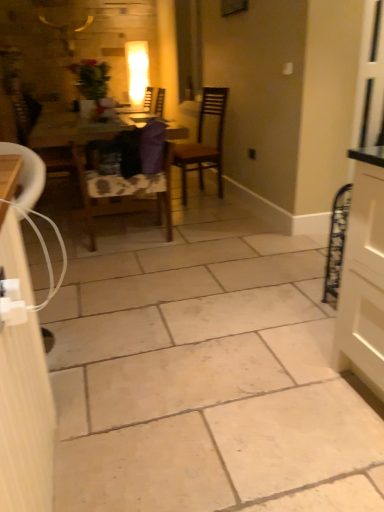
Question: Which direction should I rotate to face brown wooden chair at center, which is counted as the 1th chair, starting from the right, — up or down?

Choices:
 (A) down
 (B) up

Answer: (B)

Question: From the image's perspective, is wooden chair at center, arranged as the second chair when viewed from the right, beneath white glossy cabinet at left?

Choices:
 (A) yes
 (B) no

Answer: (B)

Question: From the image's perspective, is wooden chair at center, which is the 2th chair from left to right, on top of white glossy cabinet at left?

Choices:
 (A) yes
 (B) no

Answer: (A)

Question: Is wooden chair at center, arranged as the second chair when viewed from the right, wider than white glossy cabinet at left?

Choices:
 (A) yes
 (B) no

Answer: (B)

Question: From a real-world perspective, is wooden chair at center, arranged as the second chair when viewed from the right, on top of white glossy cabinet at left?

Choices:
 (A) no
 (B) yes

Answer: (A)

Question: Does wooden chair at center, which is the 2th chair from left to right, have a smaller size compared to white glossy cabinet at left?

Choices:
 (A) yes
 (B) no

Answer: (B)

Question: Does wooden chair at center, which is the 2th chair from left to right, come in front of white glossy cabinet at left?

Choices:
 (A) no
 (B) yes

Answer: (A)

Question: Is wooden chair at center, which is the 2th chair from left to right, facing towards wooden chair at left, marked as the 1th chair in a left-to-right arrangement?

Choices:
 (A) no
 (B) yes

Answer: (B)

Question: Can you confirm if wooden chair at center, which is the 2th chair from left to right, is shorter than wooden chair at left, marked as the 1th chair in a left-to-right arrangement?

Choices:
 (A) yes
 (B) no

Answer: (A)

Question: Considering the relative sizes of wooden chair at center, which is the 2th chair from left to right, and wooden chair at left, the third chair in the right-to-left sequence, in the image provided, is wooden chair at center, which is the 2th chair from left to right, taller than wooden chair at left, the third chair in the right-to-left sequence,?

Choices:
 (A) no
 (B) yes

Answer: (A)

Question: Considering the relative positions of wooden chair at center, which is the 2th chair from left to right, and wooden chair at left, marked as the 1th chair in a left-to-right arrangement, in the image provided, is wooden chair at center, which is the 2th chair from left to right, to the right of wooden chair at left, marked as the 1th chair in a left-to-right arrangement, from the viewer's perspective?

Choices:
 (A) no
 (B) yes

Answer: (B)

Question: Does wooden chair at center, arranged as the second chair when viewed from the right, have a lesser width compared to wooden chair at left, marked as the 1th chair in a left-to-right arrangement?

Choices:
 (A) yes
 (B) no

Answer: (A)

Question: From a real-world perspective, is wooden chair at center, which is the 2th chair from left to right, physically above wooden chair at left, the third chair in the right-to-left sequence?

Choices:
 (A) no
 (B) yes

Answer: (A)

Question: Is the depth of wooden chair at left, the third chair in the right-to-left sequence, less than that of brown wooden chair at center, which is the third chair from left to right?

Choices:
 (A) no
 (B) yes

Answer: (B)